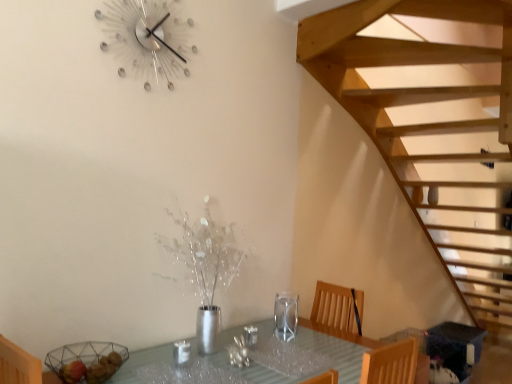
Question: In the image, is clear glass table at center positioned in front of or behind metallic crystal wall clock at upper center?

Choices:
 (A) behind
 (B) front

Answer: (B)

Question: Based on their sizes in the image, would you say clear glass table at center is bigger or smaller than metallic crystal wall clock at upper center?

Choices:
 (A) big
 (B) small

Answer: (A)

Question: Estimate the real-world distances between objects in this image. Which object is farther from the metallic crystal wall clock at upper center?

Choices:
 (A) clear glass table at center
 (B) transparent glass wine glass at center

Answer: (A)

Question: Estimate the real-world distances between objects in this image. Which object is farther from the clear glass table at center?

Choices:
 (A) transparent glass wine glass at center
 (B) metallic crystal wall clock at upper center

Answer: (B)